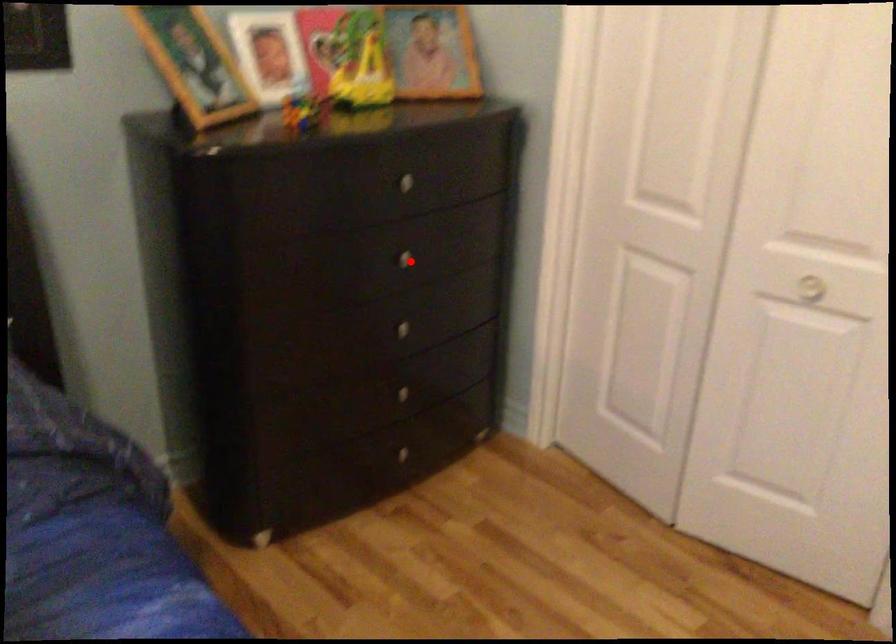
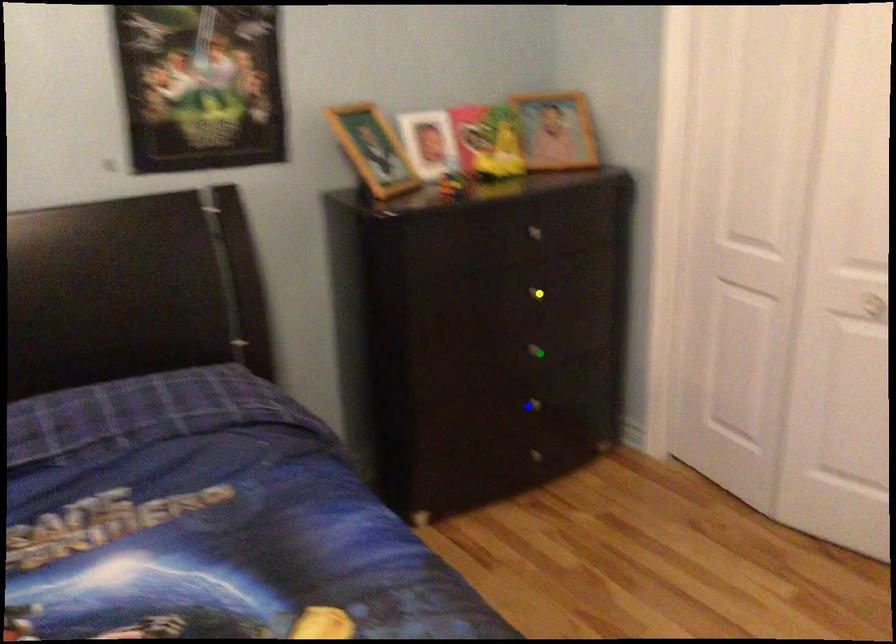
Question: I am providing you with two images of the same scene from different viewpoints. A red point is marked on the first image. You are given multiple points on the second image. Which mark in image 2 goes with the point in image 1?

Choices:
 (A) blue point
 (B) green point
 (C) yellow point

Answer: (C)